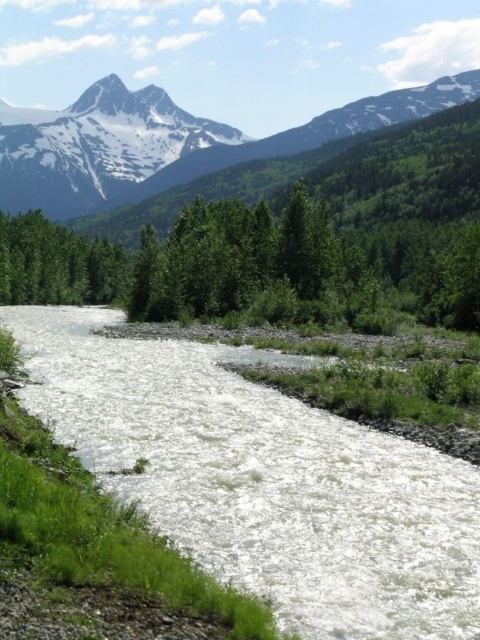
Question: Considering the relative positions of white frothy water at center and snowy granite mountain at upper center in the image provided, where is white frothy water at center located with respect to snowy granite mountain at upper center?

Choices:
 (A) above
 (B) below

Answer: (B)

Question: Does snowy granite mountain at upper center appear over snowy granite mountain at upper left?

Choices:
 (A) yes
 (B) no

Answer: (A)

Question: Based on their relative distances, which object is nearer to the snowy granite mountain at upper center?

Choices:
 (A) white frothy water at center
 (B) snowy granite mountain at upper left

Answer: (B)

Question: Which of the following is the farthest from the observer?

Choices:
 (A) (228, 138)
 (B) (119, 372)

Answer: (A)

Question: Observing the image, what is the correct spatial positioning of white frothy water at center in reference to snowy granite mountain at upper center?

Choices:
 (A) above
 (B) below

Answer: (B)

Question: Which point is closer to the camera?

Choices:
 (A) snowy granite mountain at upper center
 (B) white frothy water at center
 (C) snowy granite mountain at upper left

Answer: (B)